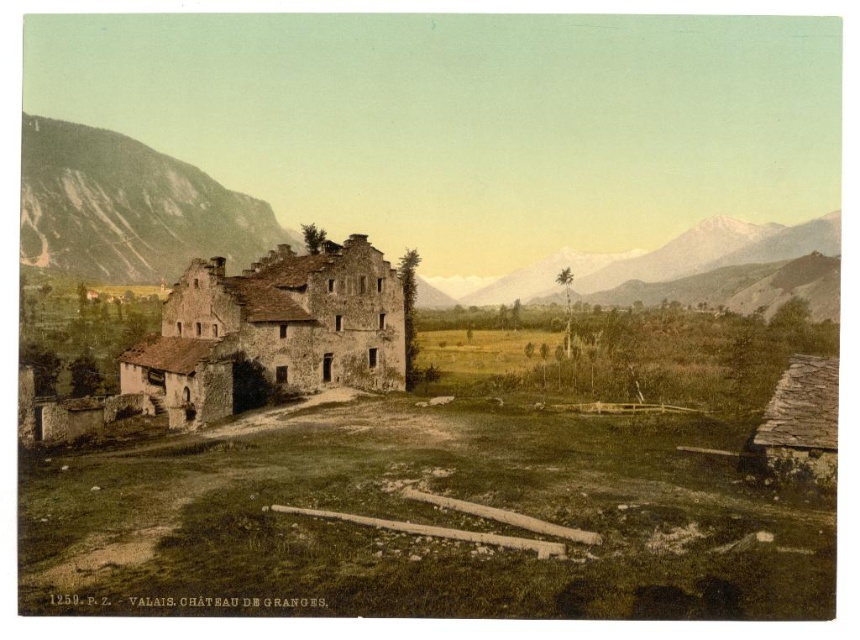
Which is in front, point (148, 196) or point (769, 221)?

Point (148, 196)

Does rustic stone mountain at left have a greater width compared to snowy granite mountain at upper right?

No, rustic stone mountain at left is not wider than snowy granite mountain at upper right.

Who is more distant from viewer, (96, 241) or (714, 268)?

The point (714, 268) is more distant.

Identify the location of rustic stone mountain at left. The height and width of the screenshot is (640, 860). [x=127, y=208].